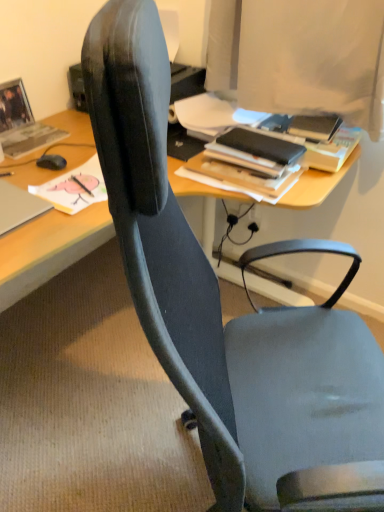
Question: From a real-world perspective, is matte gray book at upper left, arranged as the 3th book when viewed from the right, positioned over black matte mouse at left based on gravity?

Choices:
 (A) yes
 (B) no

Answer: (B)

Question: Can you confirm if matte gray book at upper left, arranged as the 3th book when viewed from the right, is smaller than black matte mouse at left?

Choices:
 (A) yes
 (B) no

Answer: (B)

Question: Does matte gray book at upper left, the first book in the left-to-right sequence, touch black matte mouse at left?

Choices:
 (A) no
 (B) yes

Answer: (A)

Question: Can you confirm if matte gray book at upper left, the first book in the left-to-right sequence, is taller than black matte mouse at left?

Choices:
 (A) yes
 (B) no

Answer: (B)

Question: Can you confirm if matte gray book at upper left, the first book in the left-to-right sequence, is thinner than black matte mouse at left?

Choices:
 (A) no
 (B) yes

Answer: (A)

Question: From the image's perspective, is matte gray book at upper left, the first book in the left-to-right sequence, above or below black matte mouse at left?

Choices:
 (A) below
 (B) above

Answer: (B)

Question: Is matte gray book at upper left, arranged as the 3th book when viewed from the right, taller or shorter than black matte mouse at left?

Choices:
 (A) tall
 (B) short

Answer: (B)

Question: Is matte gray book at upper left, arranged as the 3th book when viewed from the right, to the left or to the right of black matte mouse at left in the image?

Choices:
 (A) right
 (B) left

Answer: (B)

Question: In terms of width, does matte gray book at upper left, arranged as the 3th book when viewed from the right, look wider or thinner when compared to black matte mouse at left?

Choices:
 (A) wide
 (B) thin

Answer: (A)

Question: Considering the positions of point (82, 178) and point (54, 160), is point (82, 178) closer or farther from the camera than point (54, 160)?

Choices:
 (A) farther
 (B) closer

Answer: (B)

Question: From a real-world perspective, is matte black book at upper left, the second book positioned from the left, above or below black matte mouse at left?

Choices:
 (A) above
 (B) below

Answer: (B)

Question: Is matte black book at upper left, the second book positioned from the left, inside the boundaries of black matte mouse at left, or outside?

Choices:
 (A) inside
 (B) outside

Answer: (B)

Question: In terms of height, does matte black book at upper left, positioned as the 2th book in right-to-left order, look taller or shorter compared to black matte mouse at left?

Choices:
 (A) tall
 (B) short

Answer: (B)

Question: Does point (56, 133) appear closer or farther from the camera than point (281, 181)?

Choices:
 (A) closer
 (B) farther

Answer: (B)

Question: From a real-world perspective, is matte gray book at upper left, the first book in the left-to-right sequence, physically located above or below black matte book at upper right, the 3th book viewed from the left?

Choices:
 (A) above
 (B) below

Answer: (B)